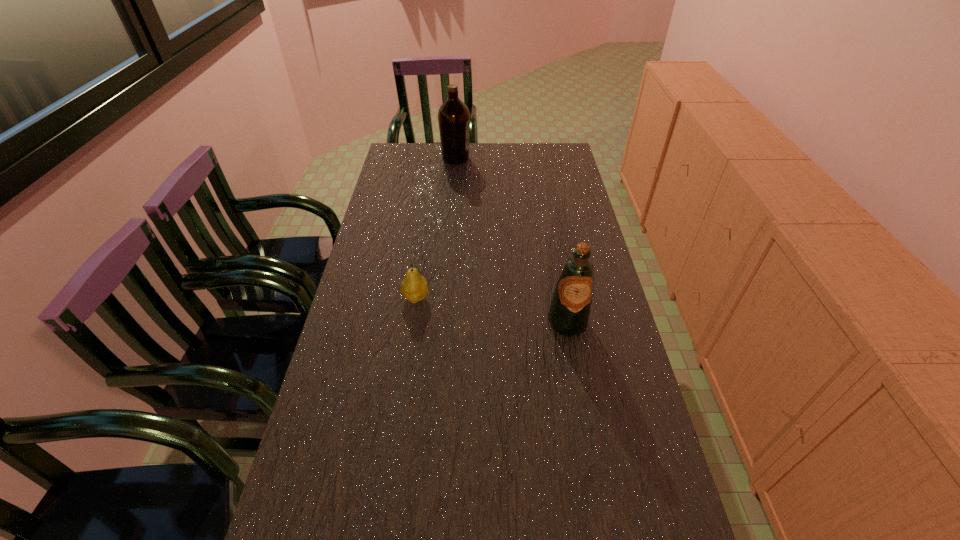
The height and width of the screenshot is (540, 960). I want to click on free spot that satisfies the following two spatial constraints: 1. on the label of the farthest object; 2. on the front side of the pear, so click(444, 298).